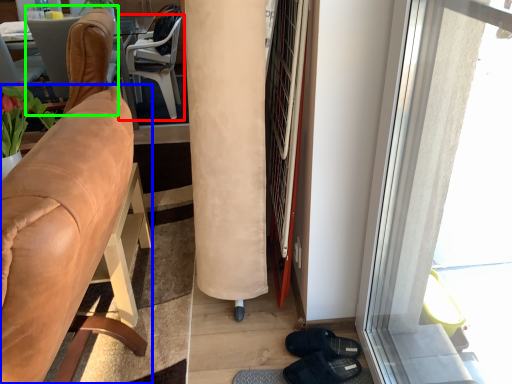
Question: Estimate the real-world distances between objects in this image. Which object is closer to chair (highlighted by a red box), chair (highlighted by a blue box) or chair (highlighted by a green box)?

Choices:
 (A) chair
 (B) chair

Answer: (B)